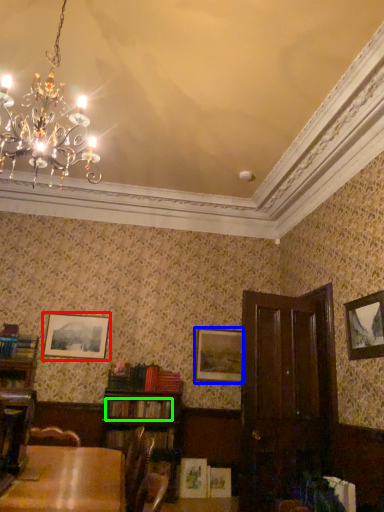
Question: Considering the real-world distances, which object is closest to picture frame (highlighted by a red box)? picture frame (highlighted by a blue box) or book (highlighted by a green box).

Choices:
 (A) picture frame
 (B) book

Answer: (A)